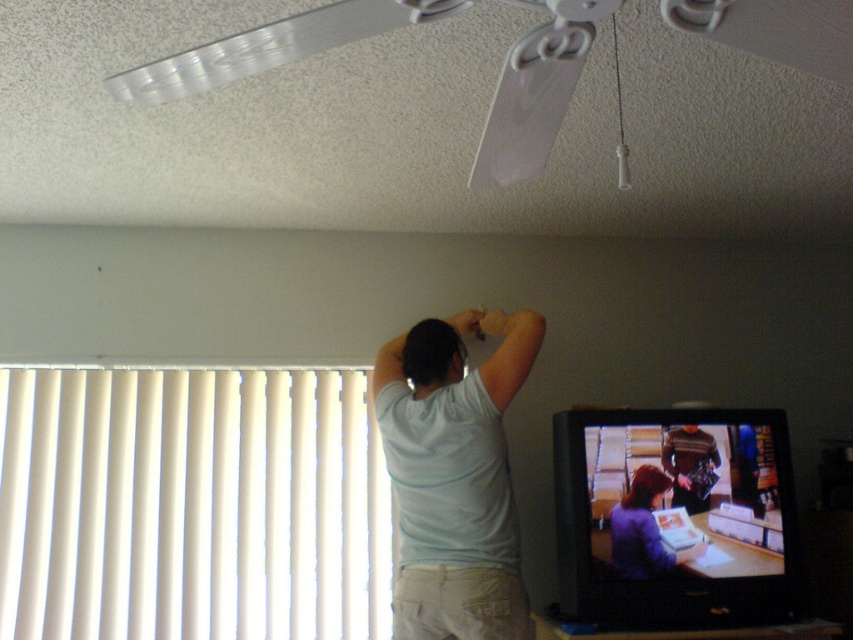
Between white vertical blinds at left and white plastic fan at upper center, which one has less height?

Standing shorter between the two is white plastic fan at upper center.

Is point (309, 464) farther from camera compared to point (409, 8)?

That is True.

Describe the element at coordinates (190, 504) in the screenshot. I see `white vertical blinds at left` at that location.

Locate an element on the screen. white vertical blinds at left is located at coordinates (190, 504).

Can you confirm if white vertical blinds at left is positioned to the left of white cotton shirt at center?

Indeed, white vertical blinds at left is positioned on the left side of white cotton shirt at center.

Is point (48, 531) farther from camera compared to point (415, 586)?

Yes, it is.

In order to click on white vertical blinds at left in this screenshot , I will do `click(190, 504)`.

Between point (251, 588) and point (668, 433), which one is positioned in front?

Point (668, 433) is more forward.

Is white vertical blinds at left to the left of matte black television at lower right from the viewer's perspective?

Correct, you'll find white vertical blinds at left to the left of matte black television at lower right.

Is point (44, 513) positioned after point (608, 460)?

Yes, it is behind point (608, 460).

Where is `white vertical blinds at left`? This screenshot has height=640, width=853. white vertical blinds at left is located at coordinates (190, 504).